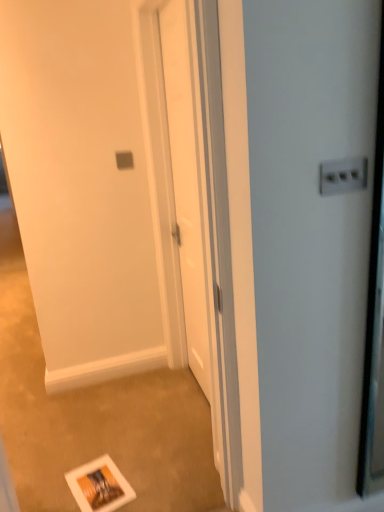
Where is `vacant space behind white glossy screen door at lower center, the 2th screen door in the back-to-front sequence`? Image resolution: width=384 pixels, height=512 pixels. vacant space behind white glossy screen door at lower center, the 2th screen door in the back-to-front sequence is located at coordinates (132, 454).